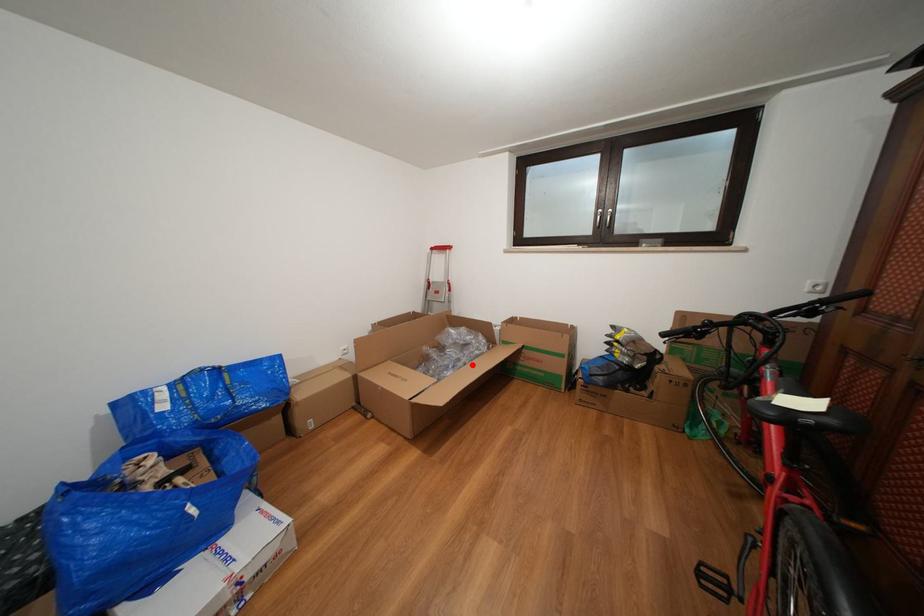
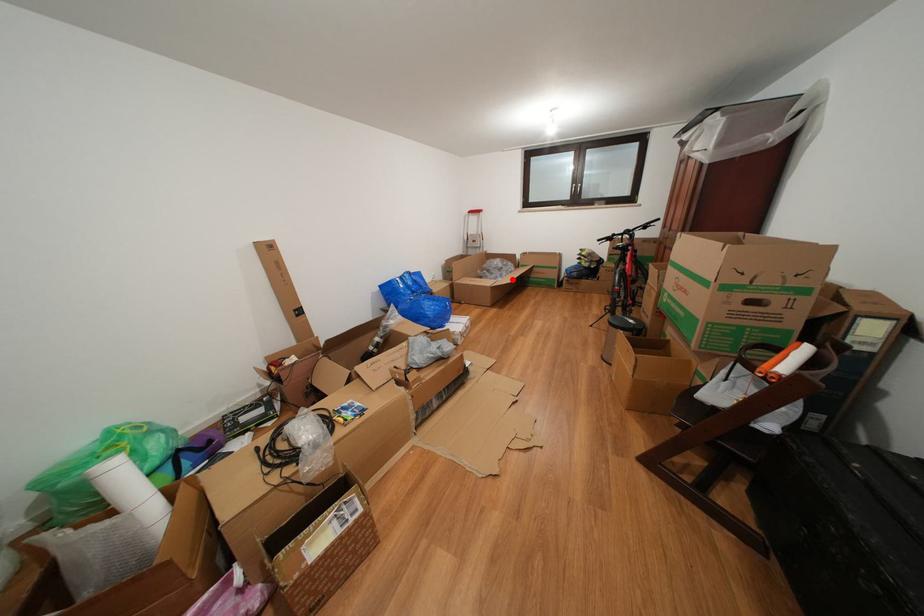
I am providing you with two images of the same scene from different viewpoints. A red point is marked on the first image and another point is marked on the second image. Are the points marked in image1 and image2 representing the same 3D position?

Yes